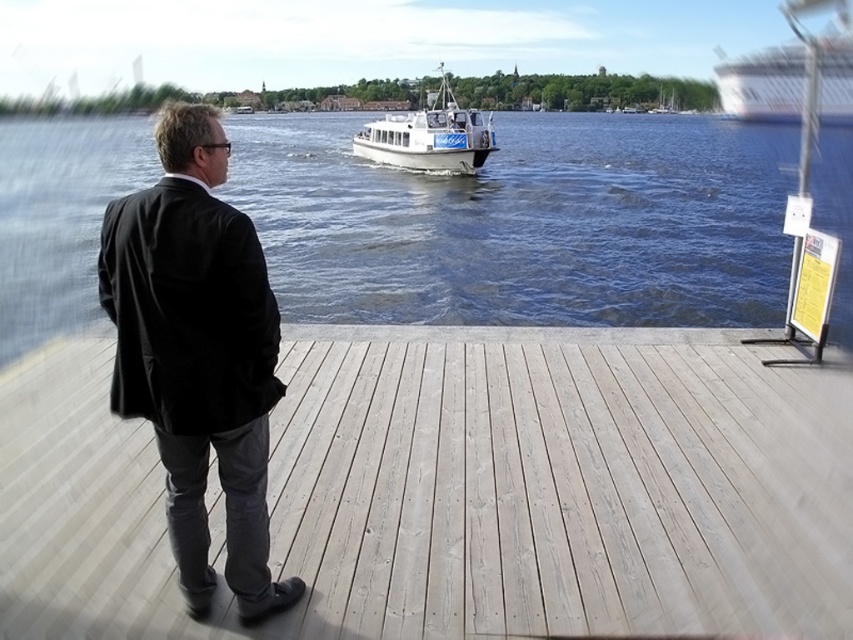
Does light wood dock at center appear over black fabric coat at center?

Incorrect, light wood dock at center is not positioned above black fabric coat at center.

Describe the element at coordinates (456, 490) in the screenshot. I see `light wood dock at center` at that location.

This screenshot has width=853, height=640. Find the location of `light wood dock at center`. light wood dock at center is located at coordinates [456, 490].

Between white glossy cruise ship at upper right and white glossy boat at center, which one has more height?

white glossy cruise ship at upper right is taller.

Who is lower down, white glossy cruise ship at upper right or white glossy boat at center?

Positioned lower is white glossy boat at center.

Is point (840, 84) positioned in front of point (468, 124)?

No, (840, 84) is further to viewer.

Find the location of a particular element. This screenshot has width=853, height=640. white glossy cruise ship at upper right is located at coordinates (790, 74).

Is light wood dock at center positioned behind white glossy cruise ship at upper right?

No, light wood dock at center is in front of white glossy cruise ship at upper right.

Between light wood dock at center and white glossy cruise ship at upper right, which one is positioned lower?

light wood dock at center

This screenshot has width=853, height=640. I want to click on light wood dock at center, so pyautogui.click(x=456, y=490).

In order to click on light wood dock at center in this screenshot , I will do `click(456, 490)`.